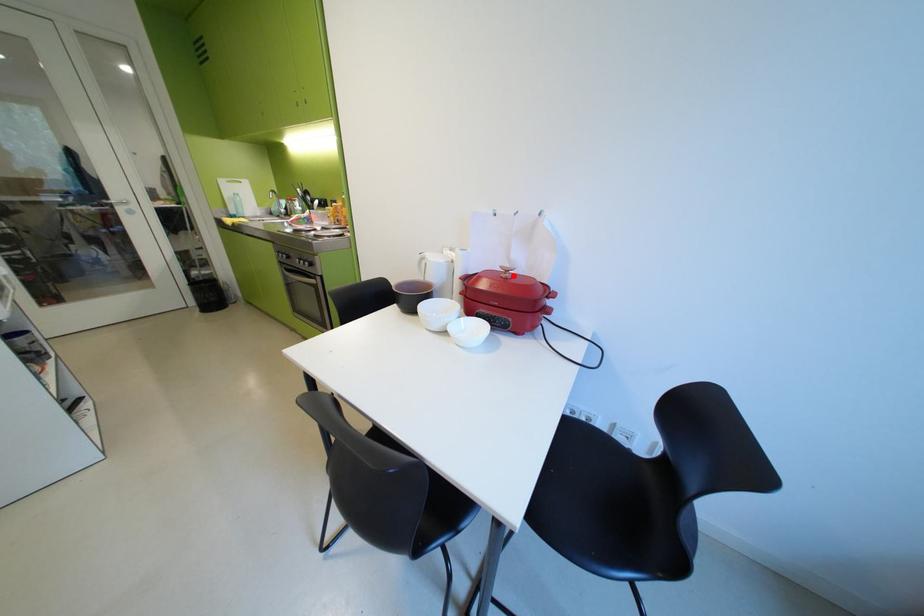
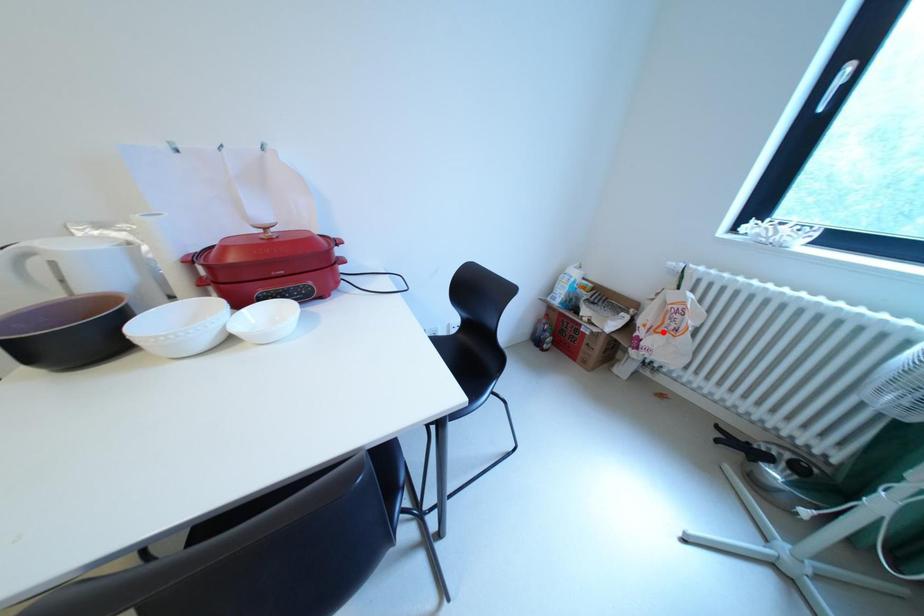
I am providing you with two images of the same scene from different viewpoints. A red point is marked on the first image and another point is marked on the second image. Is the red point in image1 aligned with the point shown in image2?

No